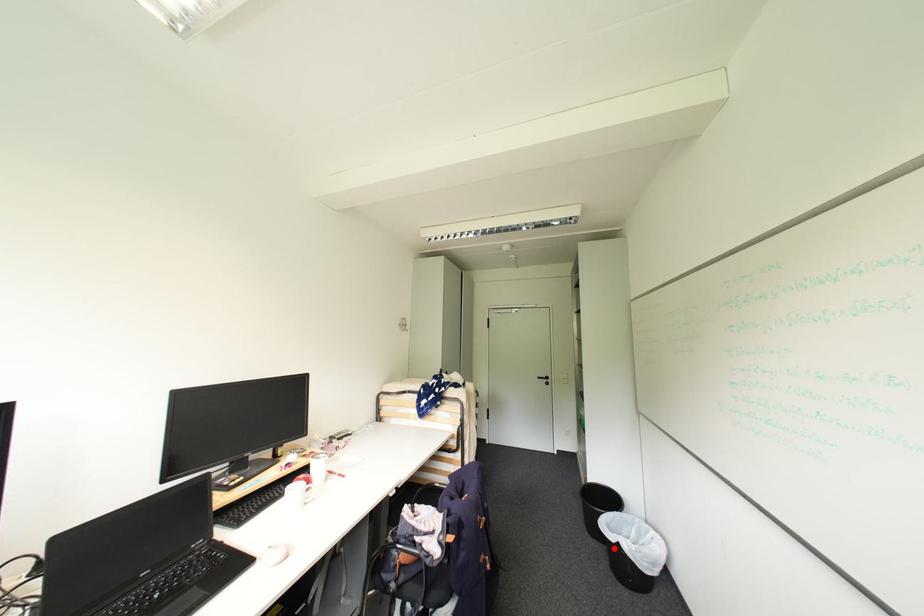
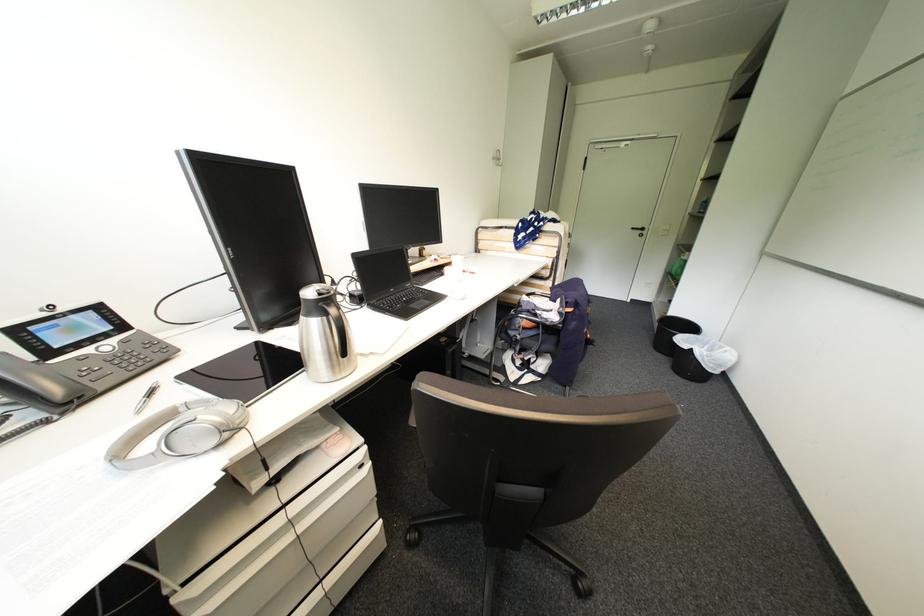
Question: A red point is marked in image1. In image2, is the corresponding 3D point closer to the camera or farther? Reply with the corresponding letter.

Choices:
 (A) The corresponding 3D point is closer.
 (B) The corresponding 3D point is farther.

Answer: (A)